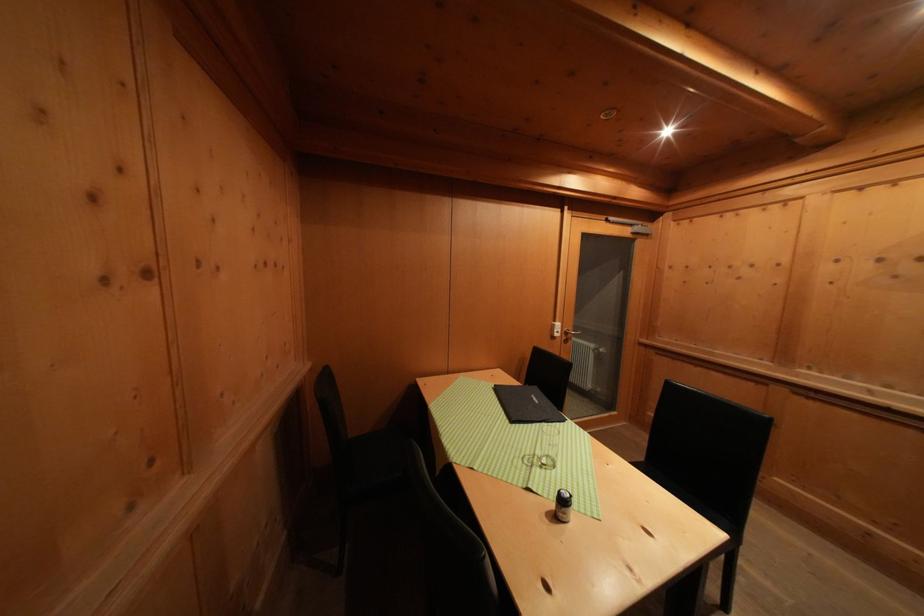
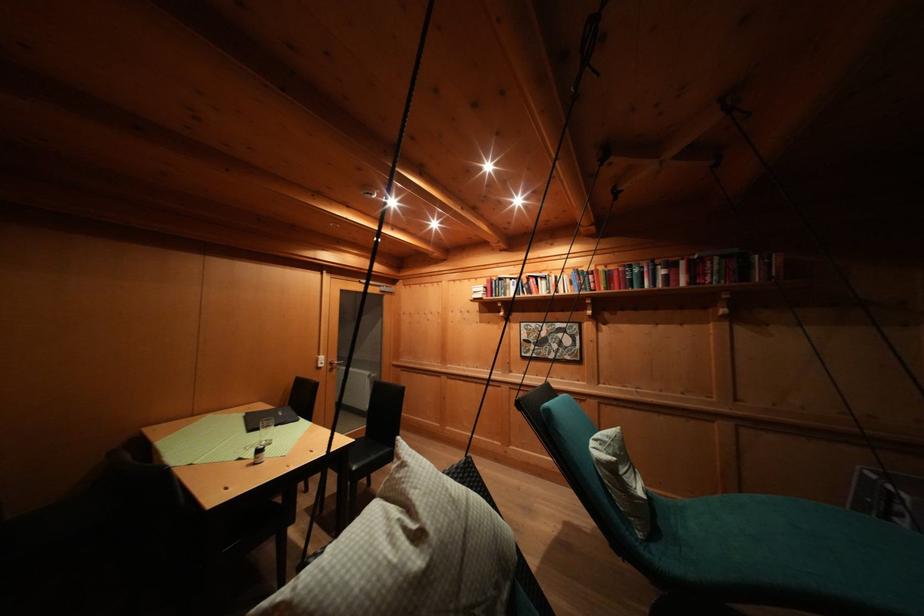
In the second image, find the point that corresponds to pixel 523 387 in the first image.

(275, 411)